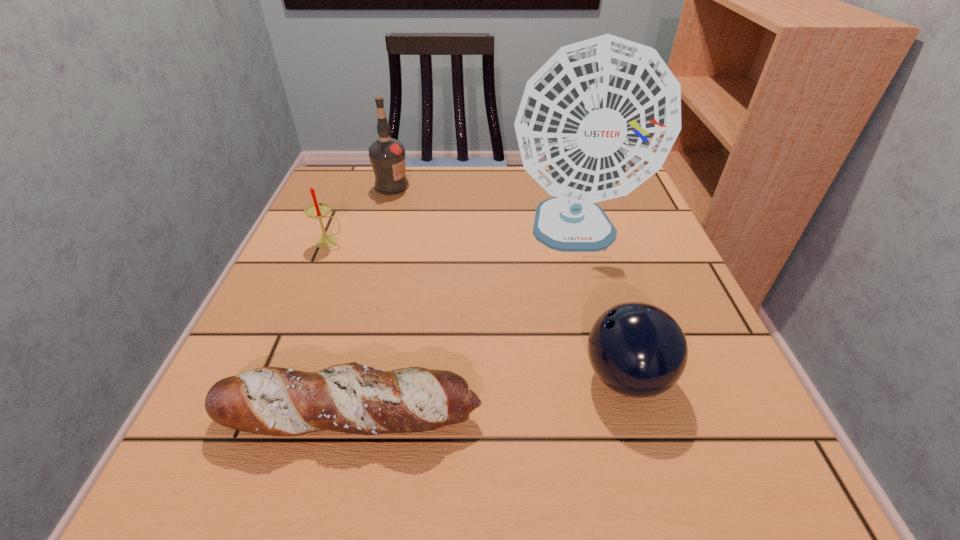
This screenshot has width=960, height=540. In order to click on fan in this screenshot , I will do `click(600, 117)`.

Locate an element on the screen. The image size is (960, 540). the farthest object is located at coordinates (387, 155).

Where is `the second tallest object`? The height and width of the screenshot is (540, 960). the second tallest object is located at coordinates (387, 155).

This screenshot has height=540, width=960. I want to click on bowling ball, so click(637, 349).

Locate an element on the screen. The image size is (960, 540). candle is located at coordinates [317, 210].

Locate an element on the screen. The height and width of the screenshot is (540, 960). baguet is located at coordinates (351, 398).

Where is `free space located 0.210m on the grille of the fan`? The height and width of the screenshot is (540, 960). free space located 0.210m on the grille of the fan is located at coordinates (610, 366).

Find the location of a particular element. This screenshot has height=540, width=960. free space located on the front label of the vodka is located at coordinates (445, 186).

Where is `free space located on the surface of the bowling ball near the finger holes`? Image resolution: width=960 pixels, height=540 pixels. free space located on the surface of the bowling ball near the finger holes is located at coordinates (470, 377).

At what (x,y) coordinates should I click in order to perform the action: click on vacant space located 0.310m on the surface of the bowling ball near the finger holes. Please return your answer as a coordinate pair (x, y). The image size is (960, 540). Looking at the image, I should click on (378, 377).